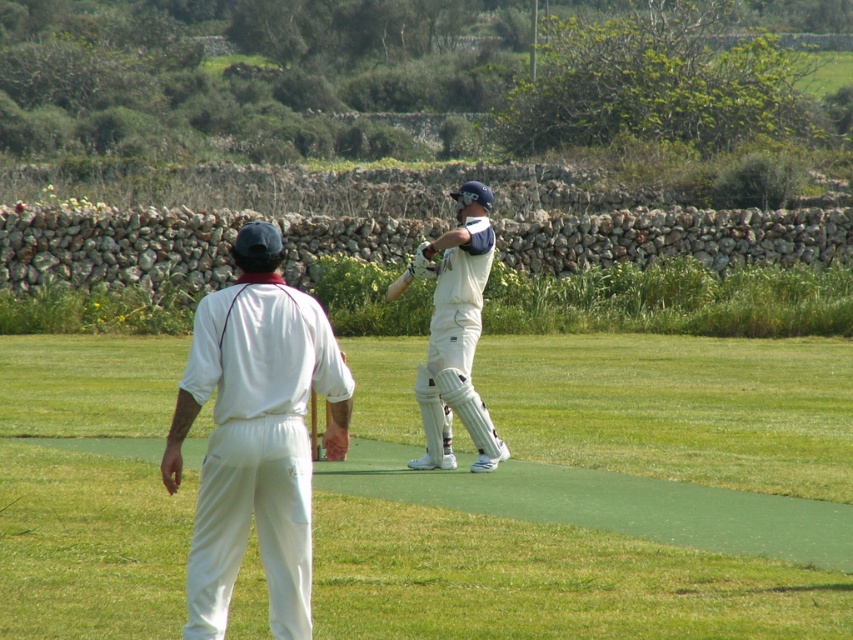
Does white fabric cricket uniform at center appear on the right side of white matte cricket bat at center?

In fact, white fabric cricket uniform at center is to the left of white matte cricket bat at center.

Which of these two, white fabric cricket uniform at center or white matte cricket bat at center, stands taller?

Standing taller between the two is white matte cricket bat at center.

Is point (228, 518) positioned behind point (450, 404)?

No, (228, 518) is closer to viewer.

Image resolution: width=853 pixels, height=640 pixels. What are the coordinates of `white fabric cricket uniform at center` in the screenshot? It's located at (256, 435).